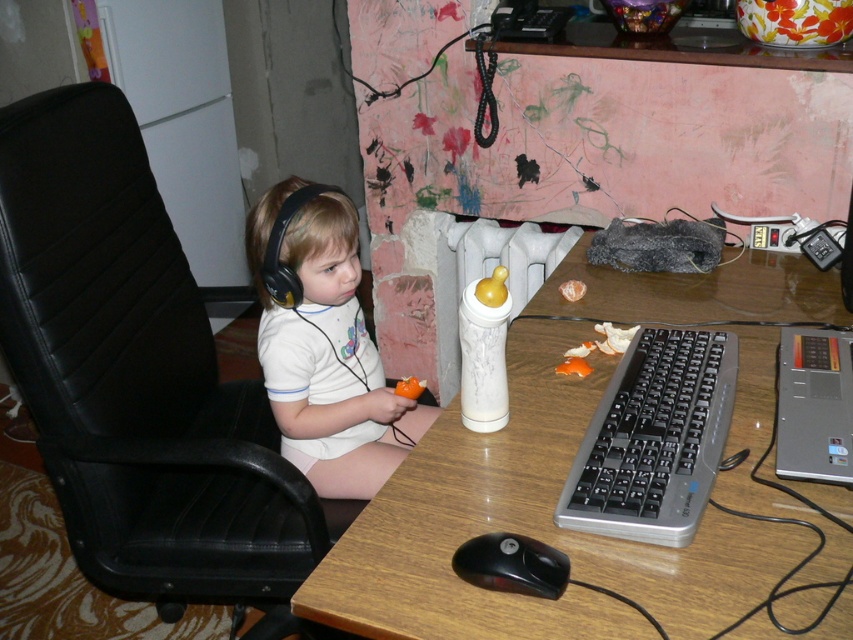
Looking at this image, does black plastic mouse at lower center appear on the left side of black matte earphone at left?

In fact, black plastic mouse at lower center is to the right of black matte earphone at left.

Identify the location of black plastic mouse at lower center. (512, 564).

Does matte white shirt at center appear under black plastic mouse at lower center?

No.

Between matte white shirt at center and black plastic mouse at lower center, which one appears on the left side from the viewer's perspective?

Positioned to the left is matte white shirt at center.

Is point (325, 305) farther from viewer compared to point (524, 579)?

Yes, point (325, 305) is behind point (524, 579).

In order to click on matte white shirt at center in this screenshot , I will do `click(326, 352)`.

Between black leather chair at left and white plastic bottle at center, which one has less height?

With less height is white plastic bottle at center.

I want to click on black leather chair at left, so click(x=138, y=378).